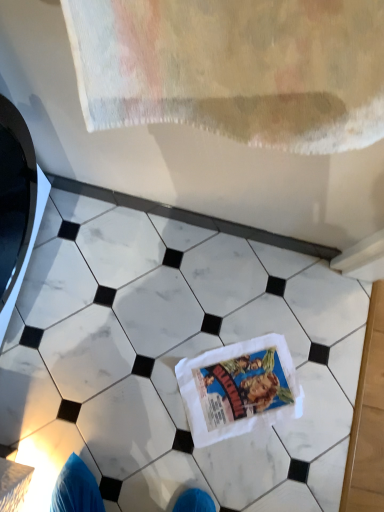
The width and height of the screenshot is (384, 512). I want to click on free region under white cotton comic book at center (from a real-world perspective), so click(x=241, y=382).